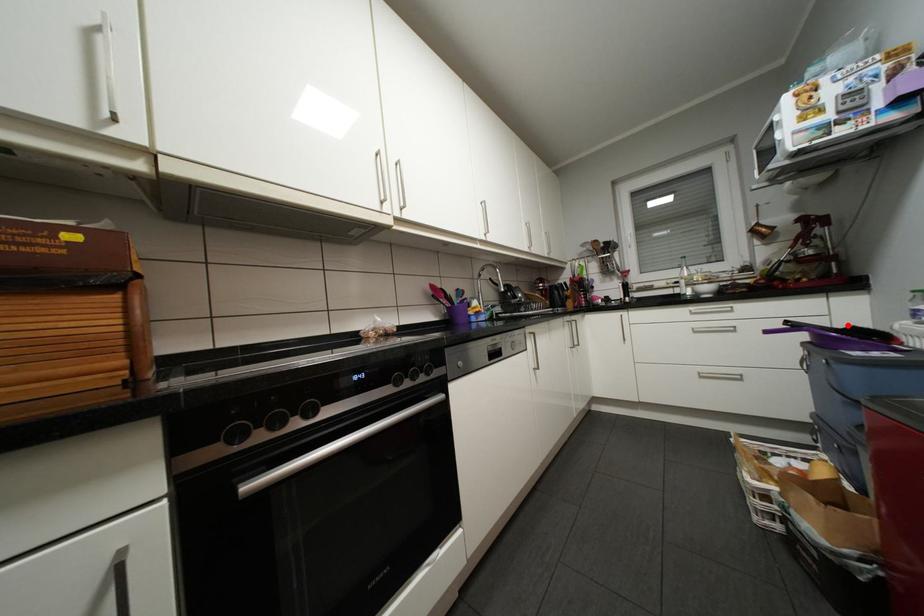
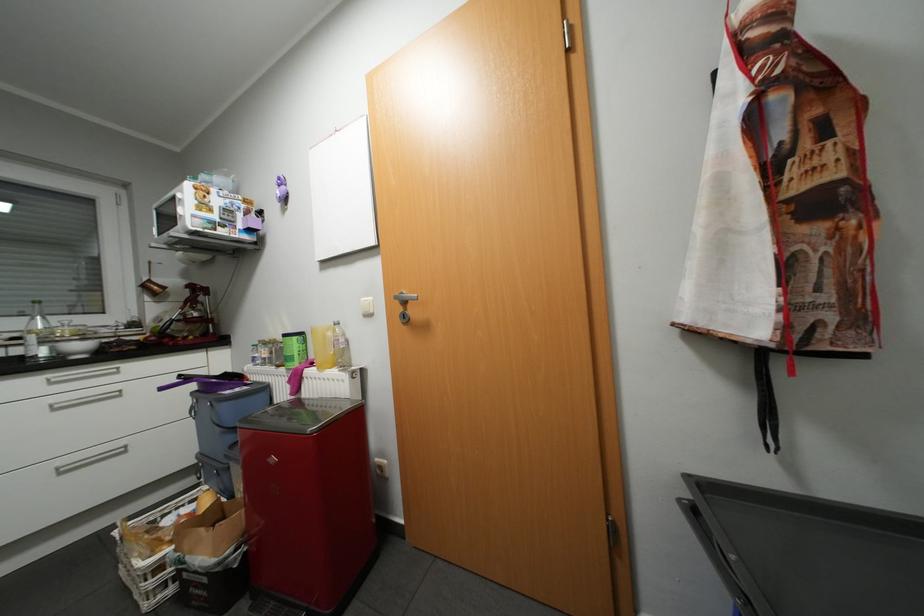
Locate, in the second image, the point that corresponds to the highlighted location in the first image.

(225, 371)